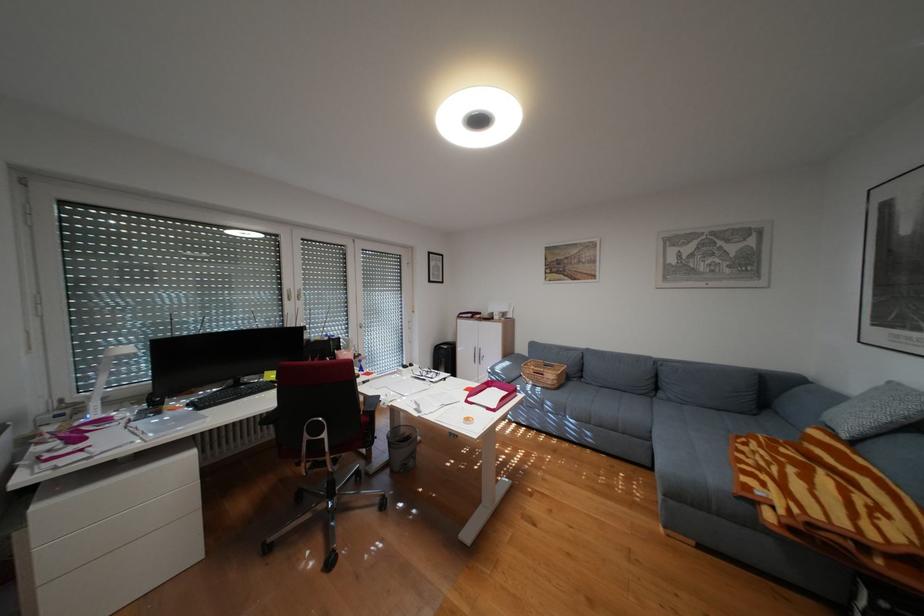
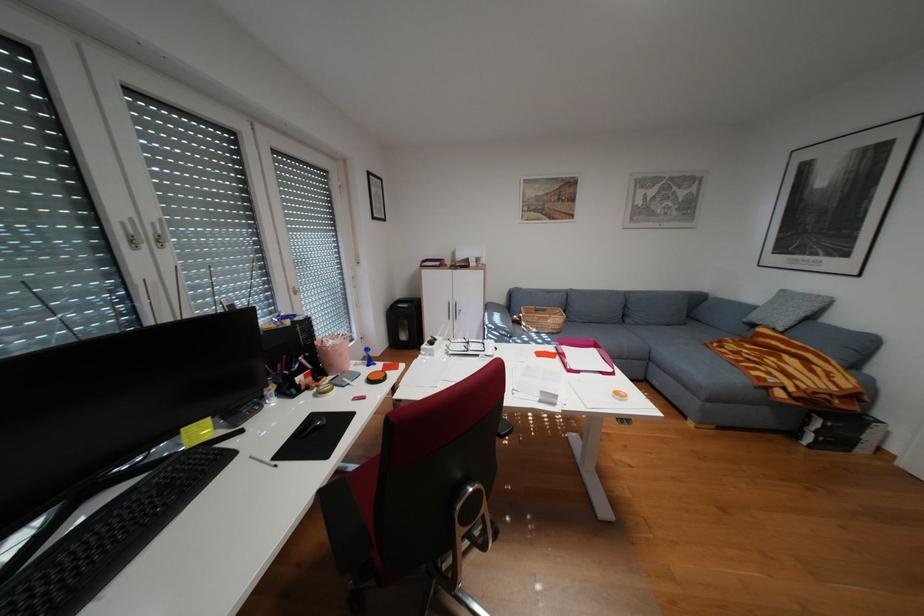
Find the pixel in the second image that matches (565,365) in the first image.

(556, 310)